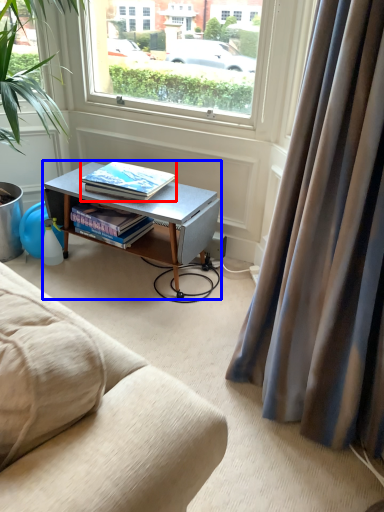
Question: Which object appears farthest to the camera in this image, book (highlighted by a red box) or desk (highlighted by a blue box)?

Choices:
 (A) book
 (B) desk

Answer: (A)